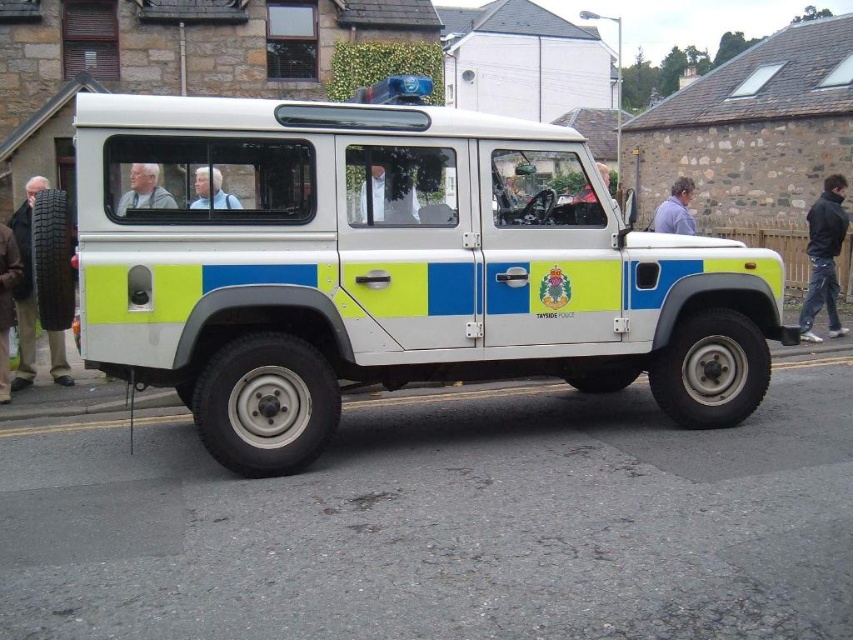
What do you see at coordinates (392, 269) in the screenshot? The height and width of the screenshot is (640, 853). I see `white matte vehicle at center` at bounding box center [392, 269].

Who is more distant from viewer, (370, 212) or (677, 198)?

The point (677, 198) is more distant.

You are a GUI agent. You are given a task and a screenshot of the screen. Output one action in this format:
    pyautogui.click(x=<x>, y=<y>)
    Task: Click on the white matte vehicle at center
    
    Given the screenshot: What is the action you would take?
    pyautogui.click(x=392, y=269)

Who is shorter, black leather jacket at right or light blue shirt at center?

Standing shorter between the two is light blue shirt at center.

Is black leather jacket at right above light blue shirt at center?

Correct, black leather jacket at right is located above light blue shirt at center.

Between point (828, 333) and point (215, 176), which one is positioned in front?

Point (215, 176) is in front.

The height and width of the screenshot is (640, 853). Identify the location of black leather jacket at right. (824, 257).

Between white matte vehicle at center and light blue shirt at center, which one appears on the left side from the viewer's perspective?

From the viewer's perspective, light blue shirt at center appears more on the left side.

Between white matte vehicle at center and light blue shirt at center, which one is positioned higher?

light blue shirt at center is higher up.

What do you see at coordinates (392, 269) in the screenshot? The image size is (853, 640). I see `white matte vehicle at center` at bounding box center [392, 269].

Identify the location of white matte vehicle at center. (392, 269).